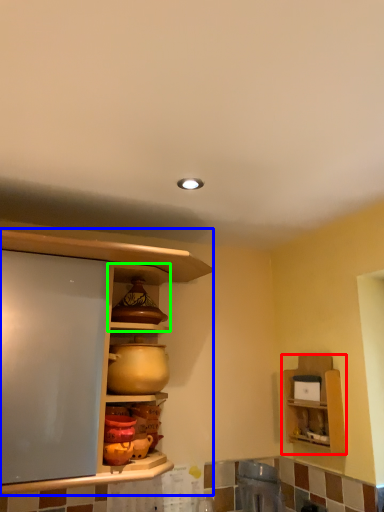
Question: Which object is the closest to the shelf (highlighted by a red box)? Choose among these: cabinetry (highlighted by a blue box) or cabinet (highlighted by a green box).

Choices:
 (A) cabinetry
 (B) cabinet

Answer: (B)